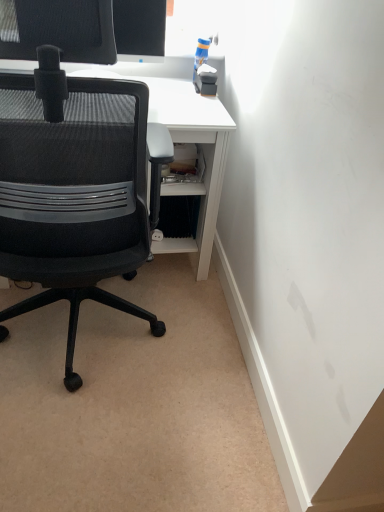
Image resolution: width=384 pixels, height=512 pixels. I want to click on free space to the right of black mesh chair at left, so click(199, 367).